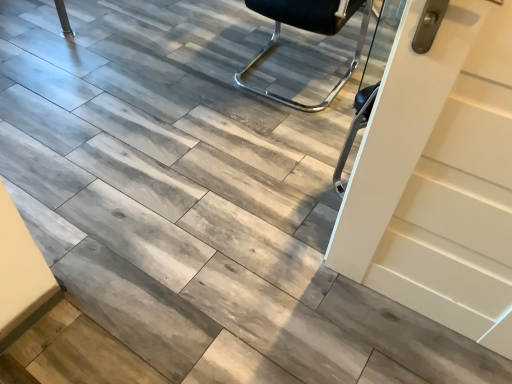
This screenshot has width=512, height=384. What are the coordinates of `vacant position to the left of white glossy door at right` in the screenshot? It's located at (295, 298).